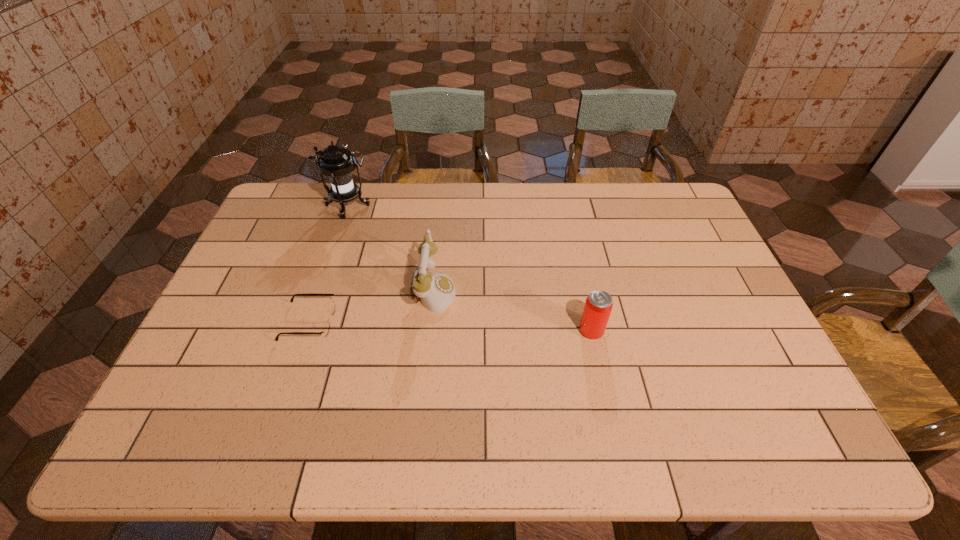
Image resolution: width=960 pixels, height=540 pixels. I want to click on blank area in the image that satisfies the following two spatial constraints: 1. on the dial of the rightmost object; 2. on the right side of the telephone, so 429,330.

Where is `vacant space that satisfies the following two spatial constraints: 1. on the dial of the second object from right to left; 2. on the back side of the can`? This screenshot has width=960, height=540. vacant space that satisfies the following two spatial constraints: 1. on the dial of the second object from right to left; 2. on the back side of the can is located at coordinates (429, 330).

Where is `vacant space that satisfies the following two spatial constraints: 1. at the hinge ends of the spectacles; 2. on the back side of the can`? vacant space that satisfies the following two spatial constraints: 1. at the hinge ends of the spectacles; 2. on the back side of the can is located at coordinates (307, 330).

Where is `blank space that satisfies the following two spatial constraints: 1. on the dial of the second shortest object; 2. on the left side of the second object from right to left`? blank space that satisfies the following two spatial constraints: 1. on the dial of the second shortest object; 2. on the left side of the second object from right to left is located at coordinates (429, 330).

At what (x,y) coordinates should I click in order to perform the action: click on vacant region that satisfies the following two spatial constraints: 1. on the back side of the can; 2. at the hinge ends of the shortest object. Please return your answer as a coordinate pair (x, y). The height and width of the screenshot is (540, 960). Looking at the image, I should click on (589, 322).

I want to click on blank area in the image that satisfies the following two spatial constraints: 1. on the front side of the rightmost object; 2. on the right side of the farthest object, so click(305, 330).